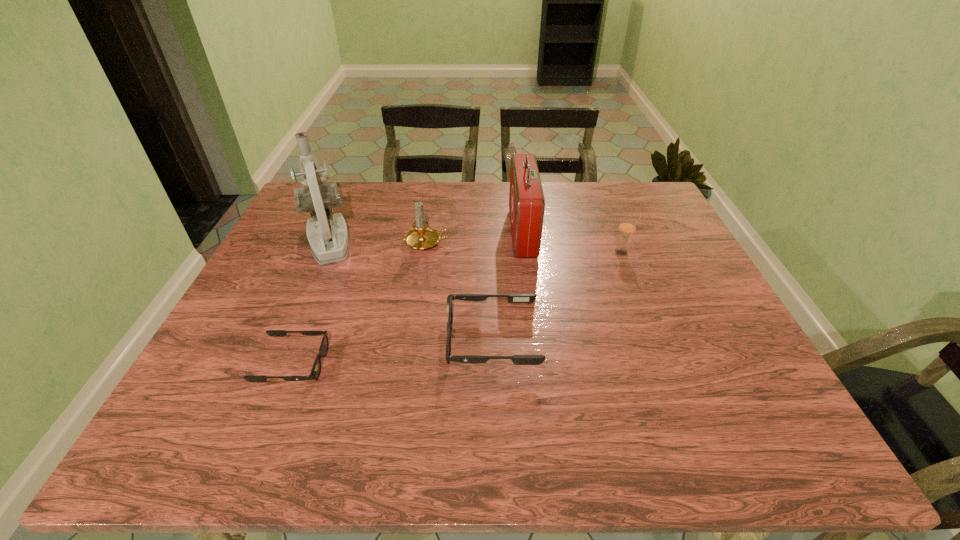
Identify the location of microscope situated at the left edge. (328, 244).

Locate an element on the screen. The image size is (960, 540). object present at the near left corner is located at coordinates (316, 369).

In the image, there is a desktop. At what (x,y) coordinates should I click in order to perform the action: click on vacant space at the far edge. Please return your answer as a coordinate pair (x, y). The image size is (960, 540). Looking at the image, I should click on (582, 195).

In order to click on vacant space at the near edge of the desktop in this screenshot , I will do `click(388, 386)`.

The width and height of the screenshot is (960, 540). Find the location of `vacant region at the left edge`. vacant region at the left edge is located at coordinates (283, 247).

This screenshot has height=540, width=960. In the image, there is a desktop. What are the coordinates of `free space at the right edge` in the screenshot? It's located at (685, 298).

At what (x,y) coordinates should I click in order to perform the action: click on vacant area at the far left corner. Please return your answer as a coordinate pair (x, y). This screenshot has width=960, height=540. Looking at the image, I should click on (296, 217).

The width and height of the screenshot is (960, 540). In the image, there is a desktop. What are the coordinates of `vacant region at the near right corner` in the screenshot? It's located at coord(759,368).

At what (x,y) coordinates should I click in order to perform the action: click on vacant space that is in between the shortest object and the tallest object. Please return your answer as a coordinate pair (x, y). Looking at the image, I should click on (310, 303).

Locate an element on the screen. The height and width of the screenshot is (540, 960). free spot between the fifth tallest object and the rightmost object is located at coordinates pyautogui.click(x=557, y=296).